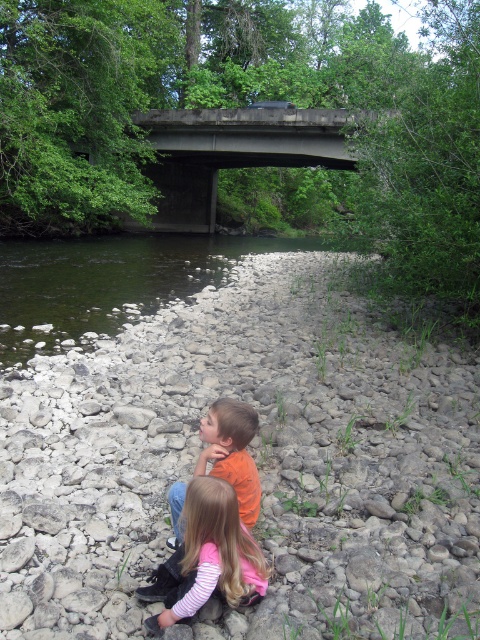
Question: Can you confirm if gray rocky river bank at lower center is wider than green smooth water at center?

Choices:
 (A) yes
 (B) no

Answer: (B)

Question: Can you confirm if gray rocky river bank at lower center is thinner than green smooth water at center?

Choices:
 (A) yes
 (B) no

Answer: (A)

Question: Considering the real-world distances, which object is closest to the green smooth water at center?

Choices:
 (A) orange matte shirt at center
 (B) light pink striped shirt at lower center

Answer: (B)

Question: Which point appears farthest from the camera in this image?

Choices:
 (A) (132, 593)
 (B) (184, 509)

Answer: (A)

Question: Which of the following is the closest to the observer?

Choices:
 (A) (x=247, y=444)
 (B) (x=202, y=568)

Answer: (B)

Question: Does gray rocky river bank at lower center appear on the left side of light pink striped shirt at lower center?

Choices:
 (A) no
 (B) yes

Answer: (A)